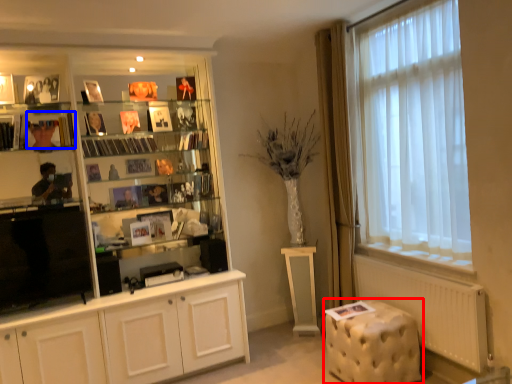
Question: Which object appears farthest to the camera in this image, music stool (highlighted by a red box) or book (highlighted by a blue box)?

Choices:
 (A) music stool
 (B) book

Answer: (B)